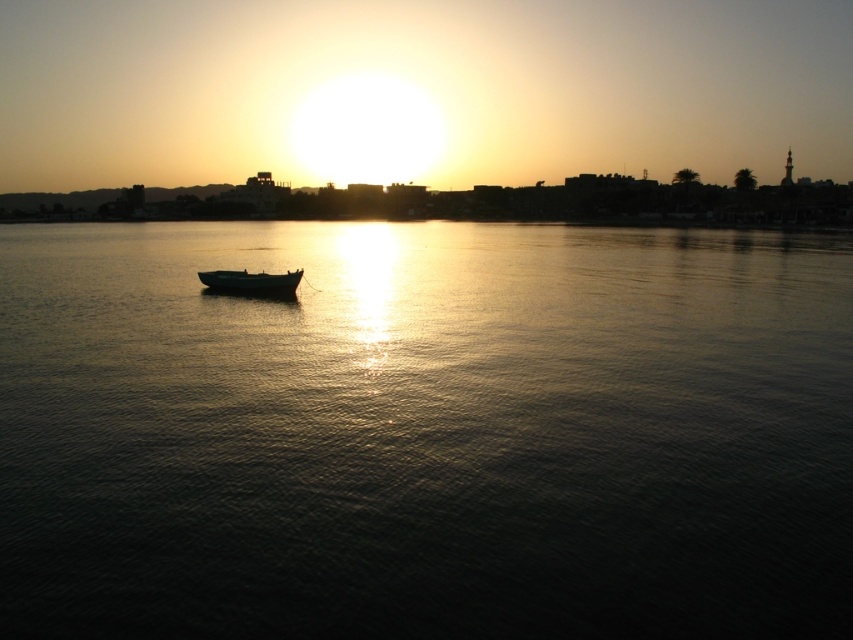
Does dark water at center lie in front of wooden boat at center?

Yes, dark water at center is closer to the viewer.

Can you confirm if dark water at center is positioned to the left of wooden boat at center?

No, dark water at center is not to the left of wooden boat at center.

Locate an element on the screen. This screenshot has height=640, width=853. dark water at center is located at coordinates (425, 433).